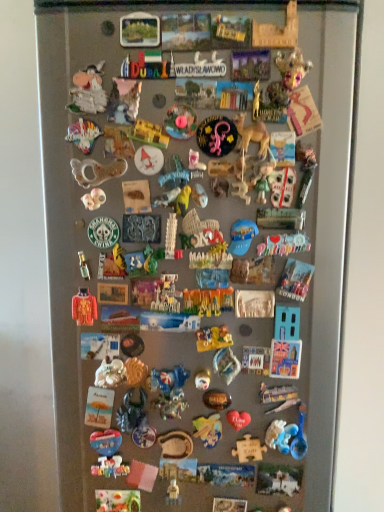
Question: Is shiny plastic dinosaur at center, the 32th toy when ordered from top to bottom, facing away from metallic silver puzzle piece at center, the 12th toy from the bottom?

Choices:
 (A) no
 (B) yes

Answer: (A)

Question: Is shiny plastic dinosaur at center, the 8th toy from the bottom, outside of metallic silver puzzle piece at center, the 12th toy from the bottom?

Choices:
 (A) yes
 (B) no

Answer: (A)

Question: From the image's perspective, is shiny plastic dinosaur at center, the 32th toy when ordered from top to bottom, beneath metallic silver puzzle piece at center, which is the 28th toy from top to bottom?

Choices:
 (A) yes
 (B) no

Answer: (A)

Question: From the image's perspective, is shiny plastic dinosaur at center, the 8th toy from the bottom, over metallic silver puzzle piece at center, the 12th toy from the bottom?

Choices:
 (A) no
 (B) yes

Answer: (A)

Question: Does shiny plastic dinosaur at center, the 32th toy when ordered from top to bottom, appear on the left side of metallic silver puzzle piece at center, the 12th toy from the bottom?

Choices:
 (A) yes
 (B) no

Answer: (A)

Question: In terms of width, does matte plastic figurine at center-right, the 27th toy from the bottom, look wider or thinner when compared to matte yellow toy dinosaur at center, the 21th toy positioned from the bottom?

Choices:
 (A) wide
 (B) thin

Answer: (B)

Question: Would you say matte plastic figurine at center-right, acting as the 13th toy starting from the top, is to the left or to the right of matte yellow toy dinosaur at center, the nineteenth toy when ordered from top to bottom, in the picture?

Choices:
 (A) left
 (B) right

Answer: (B)

Question: From a real-world perspective, is matte plastic figurine at center-right, acting as the 13th toy starting from the top, above or below matte yellow toy dinosaur at center, the 21th toy positioned from the bottom?

Choices:
 (A) below
 (B) above

Answer: (B)

Question: Based on their sizes in the image, would you say matte plastic figurine at center-right, the 27th toy from the bottom, is bigger or smaller than matte yellow toy dinosaur at center, the nineteenth toy when ordered from top to bottom?

Choices:
 (A) big
 (B) small

Answer: (B)

Question: In the image, is metallic gold toy at center, marked as the 29th toy in a top-to-bottom arrangement, on the left side or the right side of white matte figurine at center, acting as the 29th toy starting from the bottom?

Choices:
 (A) right
 (B) left

Answer: (A)

Question: Does point (201, 372) appear closer or farther from the camera than point (137, 148)?

Choices:
 (A) farther
 (B) closer

Answer: (A)

Question: Is metallic gold toy at center, marked as the 29th toy in a top-to-bottom arrangement, in front of or behind white matte figurine at center, the eleventh toy when ordered from top to bottom, in the image?

Choices:
 (A) front
 (B) behind

Answer: (B)

Question: Is metallic gold toy at center, marked as the 11th toy in a bottom-to-top arrangement, spatially inside white matte figurine at center, the eleventh toy when ordered from top to bottom, or outside of it?

Choices:
 (A) inside
 (B) outside

Answer: (B)

Question: In the image, is white plastic puzzle piece at center-right, acting as the 15th toy starting from the bottom, positioned in front of or behind matte brown figurine at center, acting as the 27th toy starting from the top?

Choices:
 (A) behind
 (B) front

Answer: (B)

Question: From a real-world perspective, is white plastic puzzle piece at center-right, the 25th toy viewed from the top, above or below matte brown figurine at center, acting as the 27th toy starting from the top?

Choices:
 (A) below
 (B) above

Answer: (B)